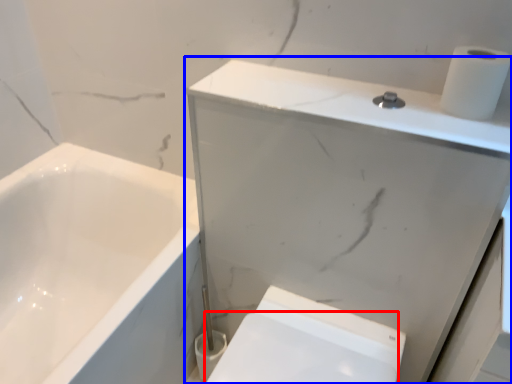
Question: Which of the following is the closest to the observer, bidet (highlighted by a red box) or medicine cabinet (highlighted by a blue box)?

Choices:
 (A) bidet
 (B) medicine cabinet

Answer: (B)